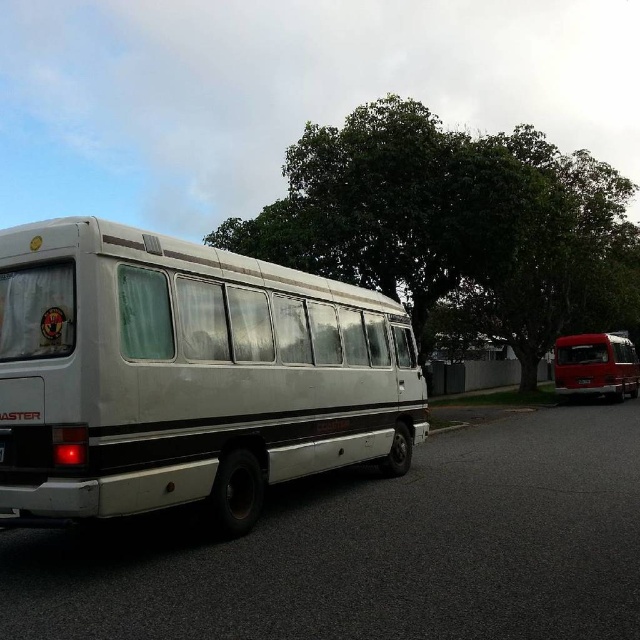
Question: Which object is the farthest from the green leafy tree at center?

Choices:
 (A) white matte bus at center
 (B) shiny red van at right

Answer: (A)

Question: Which of the following is the closest to the observer?

Choices:
 (A) shiny red van at right
 (B) green leafy tree at center

Answer: (B)

Question: Is white matte bus at center wider than shiny red van at right?

Choices:
 (A) no
 (B) yes

Answer: (A)

Question: Which point is closer to the camera taking this photo?

Choices:
 (A) click(35, 358)
 (B) click(576, 376)
 (C) click(316, 184)

Answer: (A)

Question: Does green leafy tree at center appear on the left side of shiny red van at right?

Choices:
 (A) no
 (B) yes

Answer: (B)

Question: Can you confirm if white matte bus at center is thinner than shiny red van at right?

Choices:
 (A) no
 (B) yes

Answer: (B)